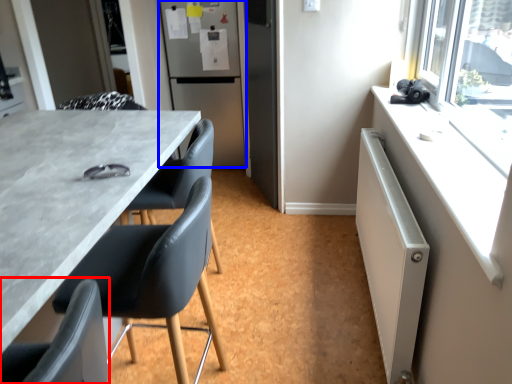
Question: Among these objects, which one is nearest to the camera, chair (highlighted by a red box) or refrigerator (highlighted by a blue box)?

Choices:
 (A) chair
 (B) refrigerator

Answer: (A)